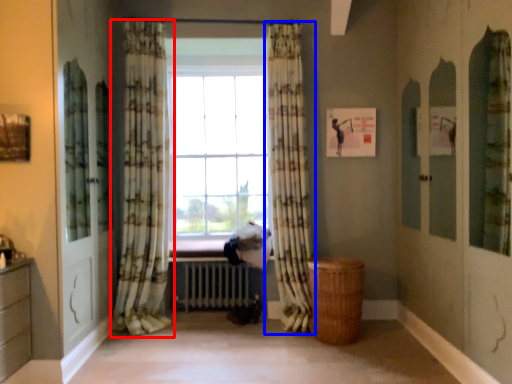
Question: Which of the following is the farthest to the observer, curtain (highlighted by a red box) or curtain (highlighted by a blue box)?

Choices:
 (A) curtain
 (B) curtain

Answer: (B)